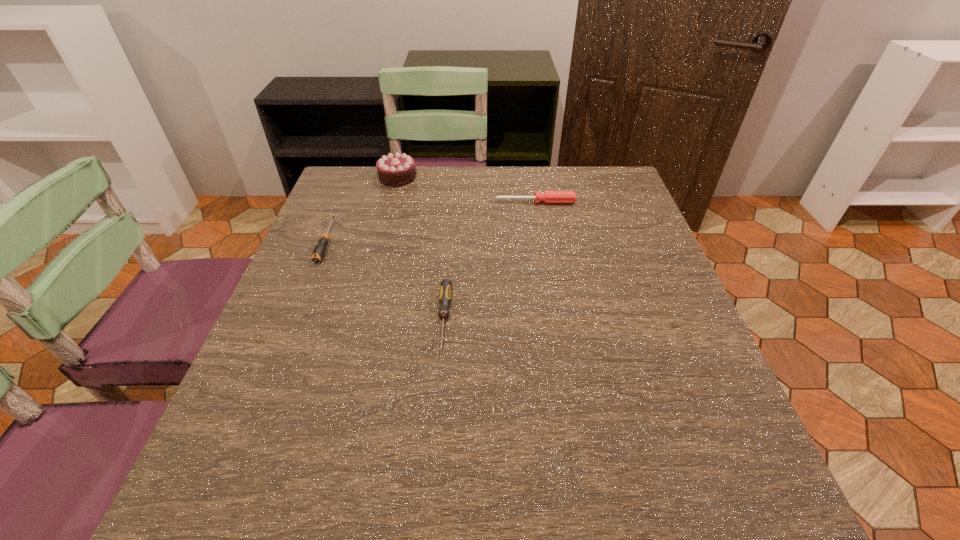
Identify the location of free space at the left edge of the desktop. This screenshot has width=960, height=540. (316, 218).

Image resolution: width=960 pixels, height=540 pixels. Find the location of `vacant space at the right edge of the desktop`. vacant space at the right edge of the desktop is located at coordinates (588, 225).

I want to click on free space at the far left corner of the desktop, so click(360, 168).

What are the coordinates of `vacant area between the farthest object and the rightmost screwdriver` in the screenshot? It's located at [x=467, y=190].

Where is `free spot between the farthest screwdriver and the leftmost object`? free spot between the farthest screwdriver and the leftmost object is located at coordinates (431, 222).

The image size is (960, 540). I want to click on free space between the second object from right to left and the leftmost screwdriver, so click(x=385, y=280).

Find the location of a particular element. The width and height of the screenshot is (960, 540). free spot between the nearest screwdriver and the second object from left to right is located at coordinates (420, 248).

Locate an element on the screen. The width and height of the screenshot is (960, 540). free space between the leftmost screwdriver and the third object from left to right is located at coordinates (385, 280).

You are a GUI agent. You are given a task and a screenshot of the screen. Output one action in this format:
    pyautogui.click(x=<x>, y=<y>)
    Task: Click on the unoccupied position between the second object from left to right and the second screwdriver from left to right
    This screenshot has height=540, width=960.
    Given the screenshot: What is the action you would take?
    pyautogui.click(x=420, y=248)

Find the location of a particular element. Image resolution: width=960 pixels, height=540 pixels. free space between the leftmost screwdriver and the second screwdriver from left to right is located at coordinates [385, 280].